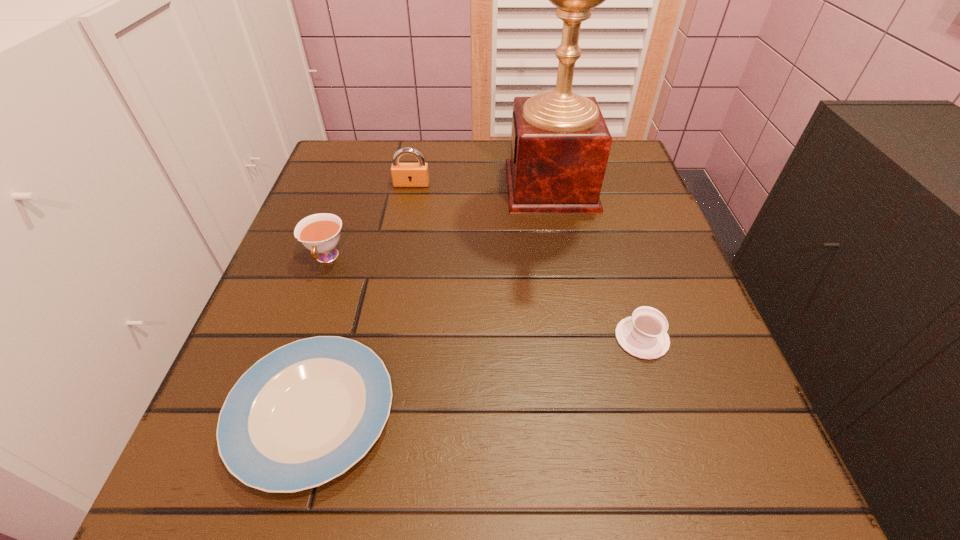
Identify the location of empty location between the padlock and the left teacup. This screenshot has height=540, width=960. (370, 221).

Identify the location of vacant area between the trophy cup and the shortest object. This screenshot has height=540, width=960. (432, 300).

You are a GUI agent. You are given a task and a screenshot of the screen. Output one action in this format:
    pyautogui.click(x=<x>, y=<y>)
    Task: Click on the empty space that is in between the trophy cup and the left teacup
    This screenshot has height=540, width=960.
    Given the screenshot: What is the action you would take?
    pyautogui.click(x=439, y=222)

Where is `vacant region between the padlock and the nearer teacup`? vacant region between the padlock and the nearer teacup is located at coordinates (527, 261).

Where is `vacant area between the fourth shortest object and the farther teacup`? vacant area between the fourth shortest object and the farther teacup is located at coordinates (370, 221).

This screenshot has width=960, height=540. I want to click on vacant area that lies between the nearer teacup and the second tallest object, so click(527, 261).

Where is `empty space that is in between the third farthest object and the fourth tallest object`? This screenshot has width=960, height=540. empty space that is in between the third farthest object and the fourth tallest object is located at coordinates (485, 298).

The image size is (960, 540). Identify the location of vacant area that lies between the trophy cup and the third tallest object. (439, 222).

In order to click on free spot between the fourth shortest object and the taller teacup in this screenshot , I will do `click(370, 221)`.

Image resolution: width=960 pixels, height=540 pixels. In order to click on empty space that is in between the second tallest object and the shorter teacup in this screenshot , I will do `click(527, 261)`.